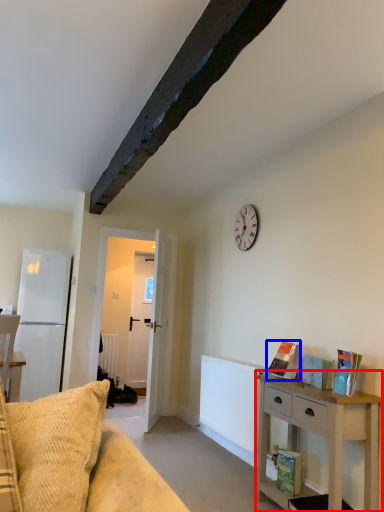
Question: Which of the following is the farthest to the observer, nightstand (highlighted by a red box) or book (highlighted by a blue box)?

Choices:
 (A) nightstand
 (B) book

Answer: (B)